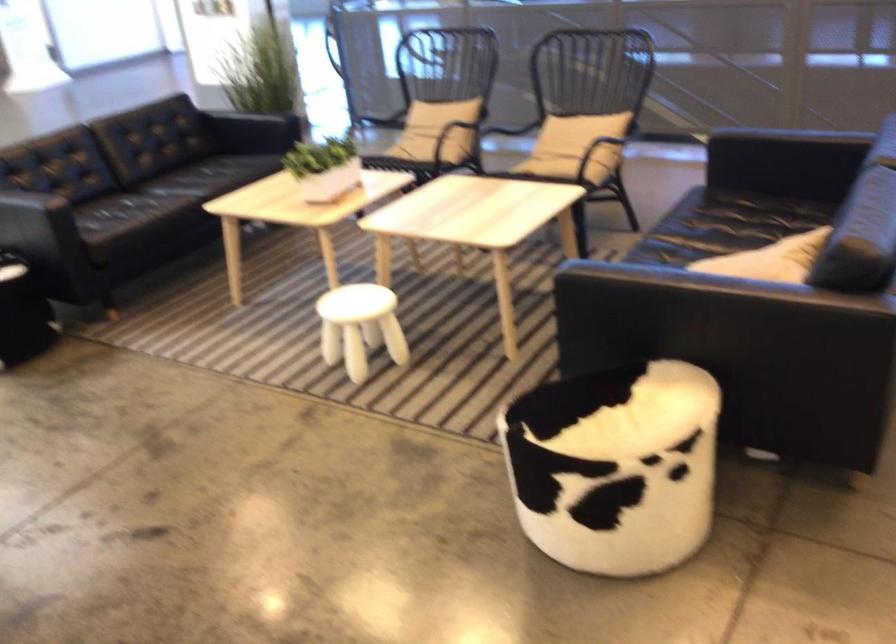
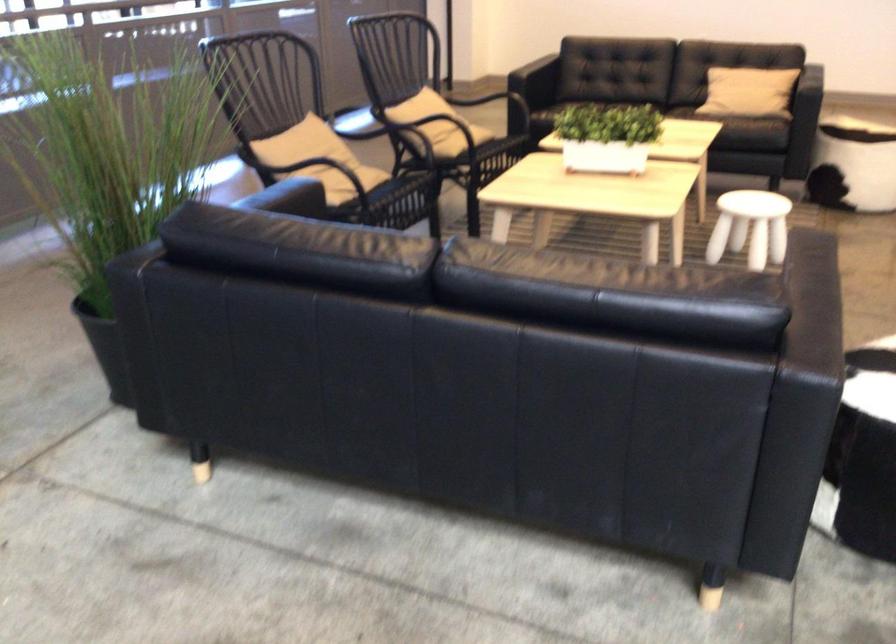
Where in the second image is the point corresponding to point (338, 313) from the first image?

(750, 227)